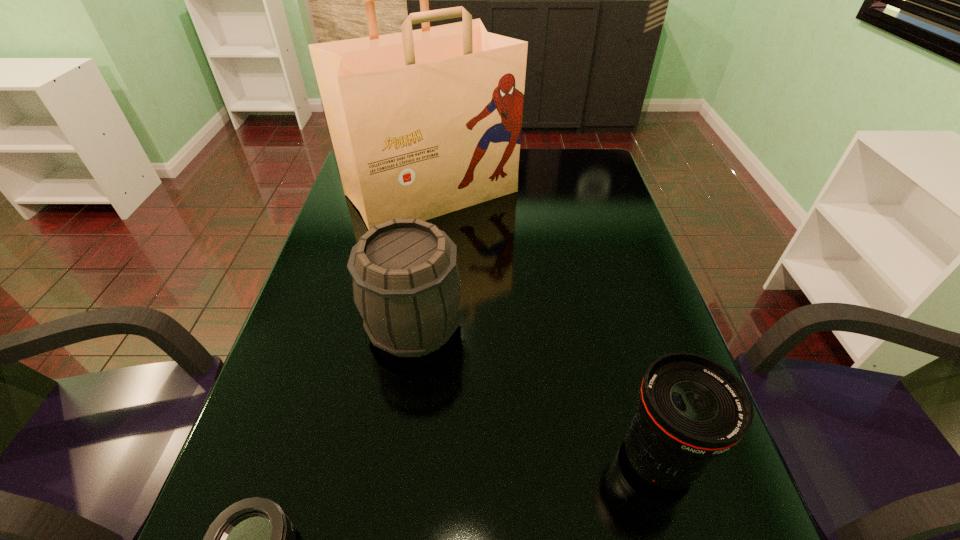
Where is `the second closest object to the shortest object`? the second closest object to the shortest object is located at coordinates (691, 409).